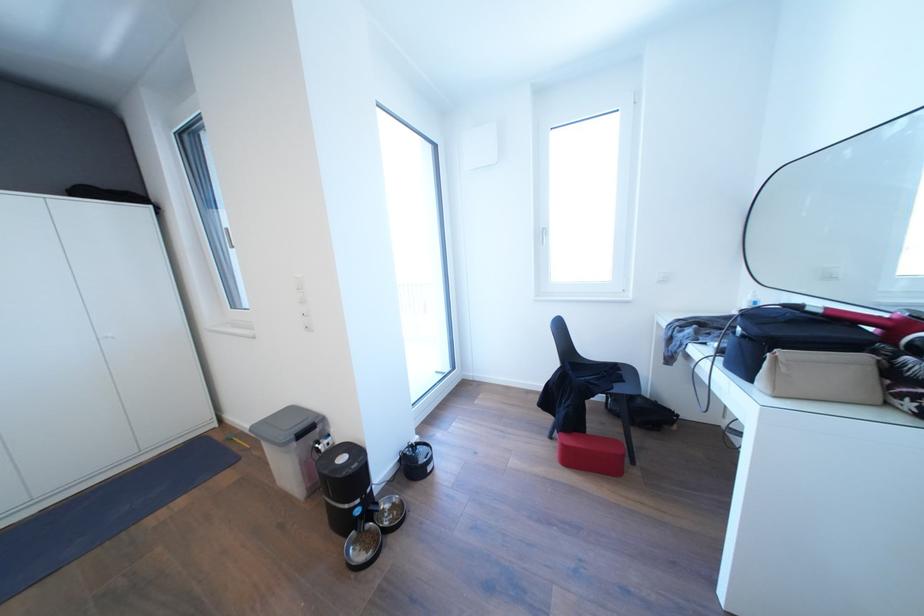
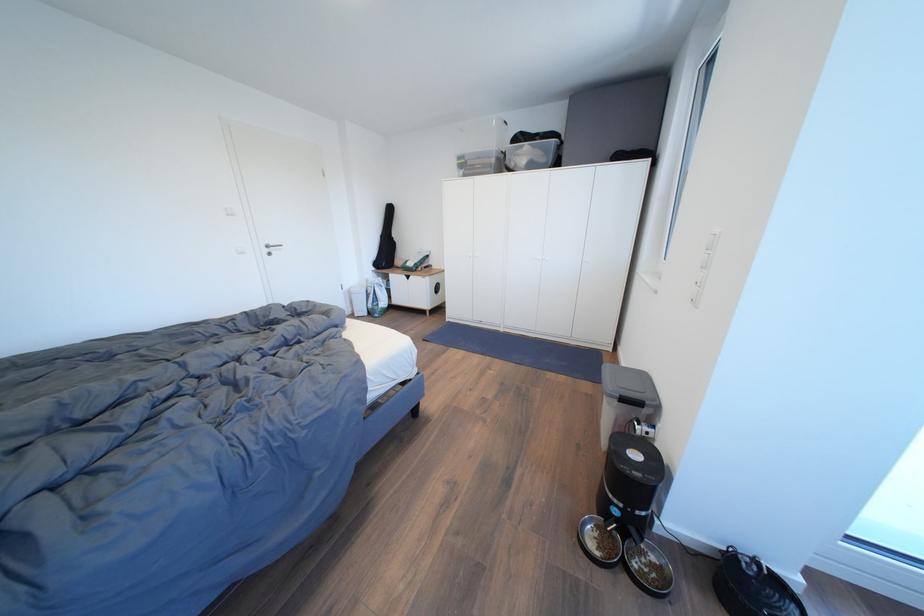
The images are taken continuously from a first-person perspective. In which direction is your viewpoint rotating?

The camera's rotation is toward left-down.